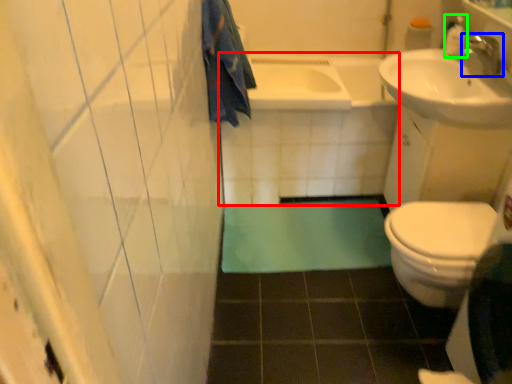
Question: Which is farther away from bath (highlighted by a red box)? tap (highlighted by a blue box) or toiletry (highlighted by a green box)?

Choices:
 (A) tap
 (B) toiletry

Answer: (A)